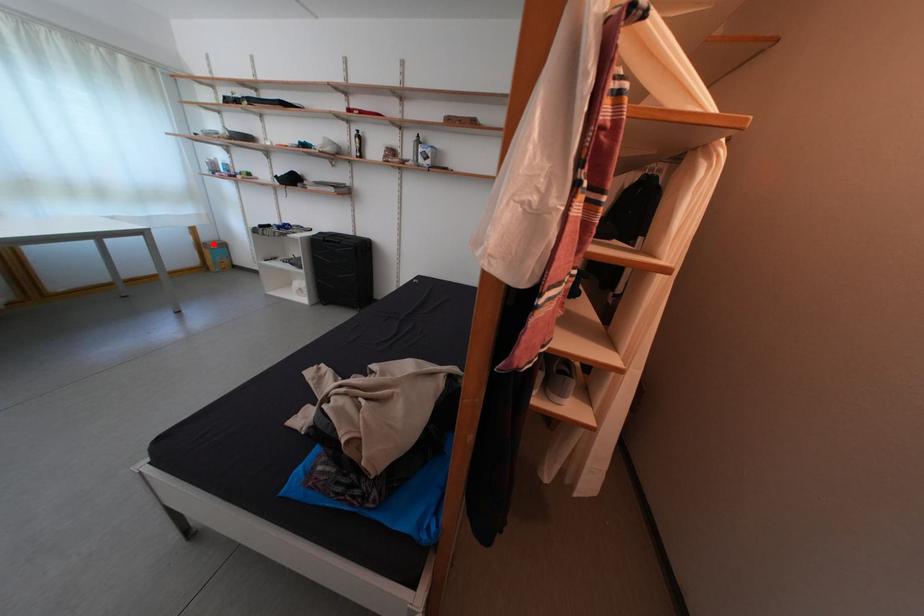
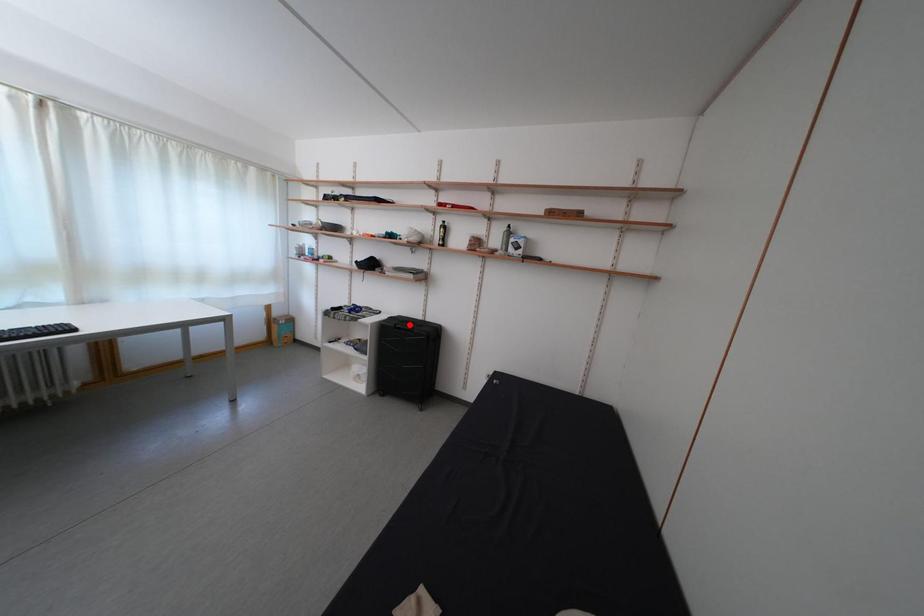
I am providing you with two images of the same scene from different viewpoints. A red point is marked on the first image and another point is marked on the second image. Is the red point in image1 aligned with the point shown in image2?

No